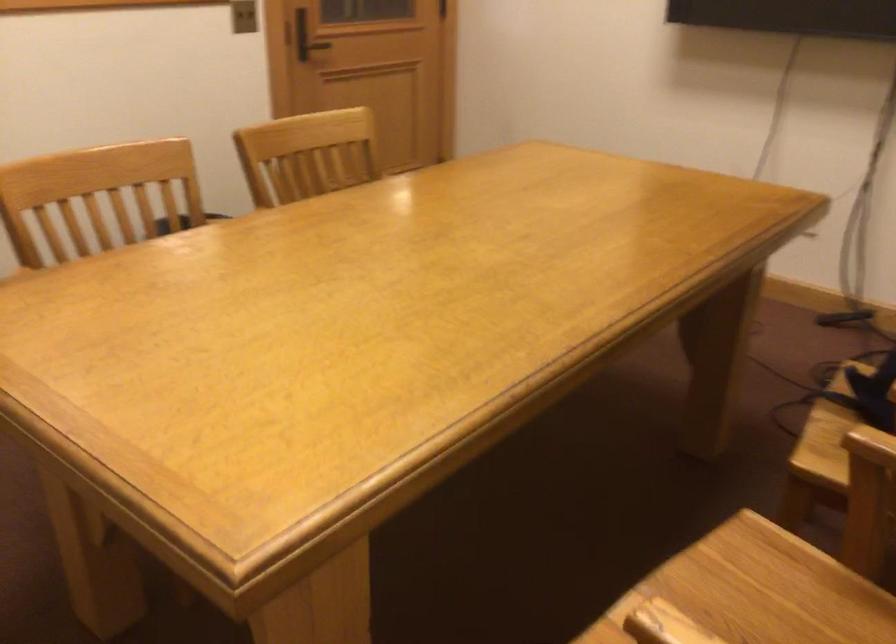
The width and height of the screenshot is (896, 644). What do you see at coordinates (308, 46) in the screenshot? I see `the black door handle` at bounding box center [308, 46].